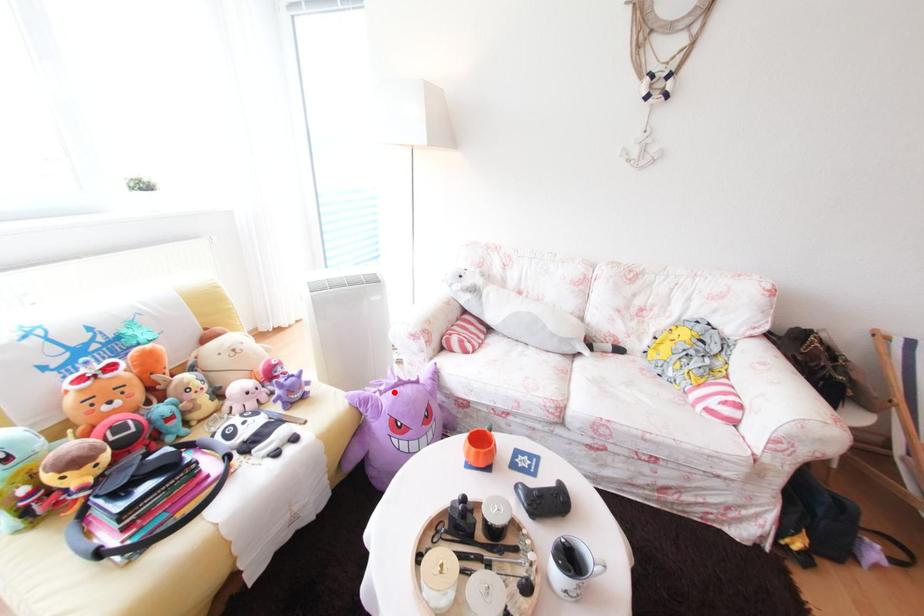
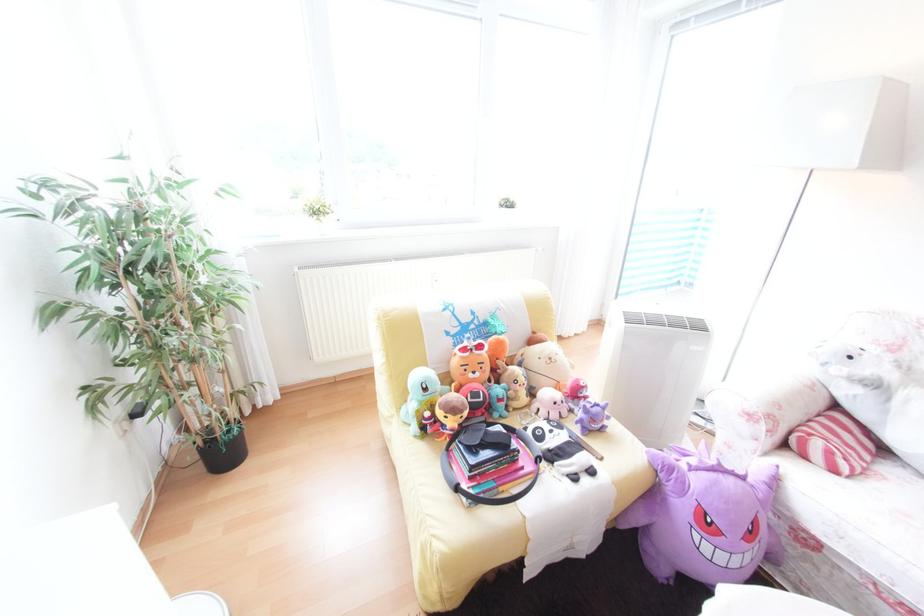
Question: I am providing you with two images of the same scene from different viewpoints. In image1, a red point is highlighted. Considering the same 3D point in image2, which of the following is correct?

Choices:
 (A) It is closer
 (B) It is farther

Answer: (B)